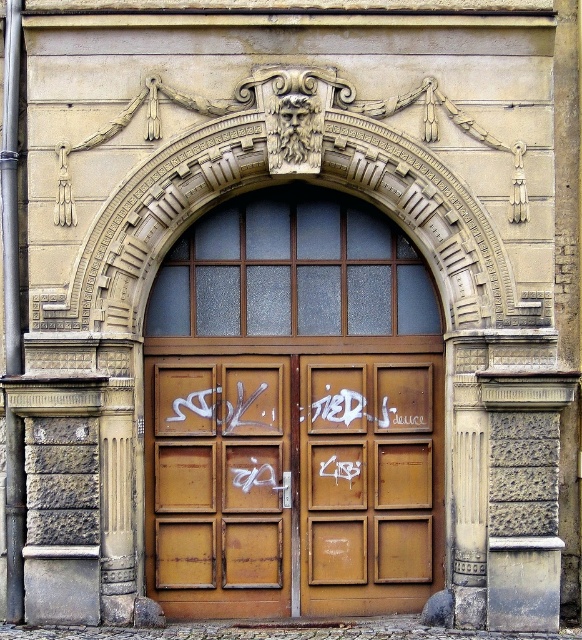
Question: Is rusty wooden door at center wider than rusty metal door at center?

Choices:
 (A) no
 (B) yes

Answer: (B)

Question: Which of the following is the closest to the observer?

Choices:
 (A) (253, 557)
 (B) (414, 604)
 (C) (300, 412)

Answer: (B)

Question: Is rusty wooden door at center closer to camera compared to rusty metal door at center?

Choices:
 (A) no
 (B) yes

Answer: (B)

Question: Among these objects, which one is nearest to the camera?

Choices:
 (A) rusty metal doors at center
 (B) rusty metal door at center

Answer: (A)

Question: Does rusty metal doors at center appear over rusty metal door at center?

Choices:
 (A) no
 (B) yes

Answer: (B)

Question: Which point is closer to the camera?

Choices:
 (A) (158, 406)
 (B) (424, 413)

Answer: (A)